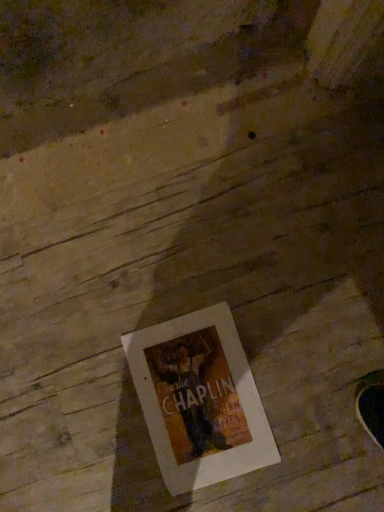
What do you see at coordinates (199, 400) in the screenshot? I see `matte paper book at center` at bounding box center [199, 400].

This screenshot has height=512, width=384. In order to click on matte paper book at center in this screenshot , I will do `click(199, 400)`.

Find the location of a particular element. This screenshot has height=512, width=384. matte paper book at center is located at coordinates (199, 400).